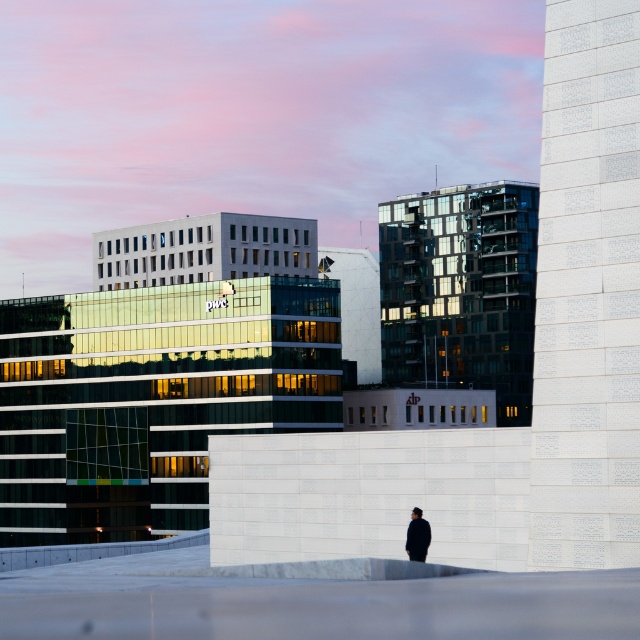
In the scene shown: Is white textured wall at right smaller than black matte jacket at center?

Actually, white textured wall at right might be larger than black matte jacket at center.

How far apart are white textured wall at right and black matte jacket at center?

white textured wall at right is 4.35 meters from black matte jacket at center.

Does point (620, 198) come behind point (412, 522)?

No, it is in front of (412, 522).

You are a GUI agent. You are given a task and a screenshot of the screen. Output one action in this format:
    pyautogui.click(x=<x>, y=<y>)
    Task: Click on the white textured wall at right
    
    Given the screenshot: What is the action you would take?
    pyautogui.click(x=588, y=292)